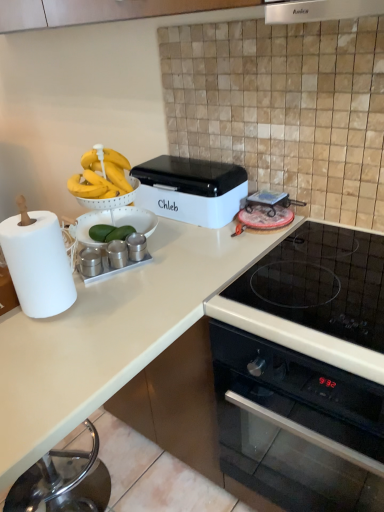
Where is `vacant area that is situated to the right of white paper at left`? This screenshot has width=384, height=512. vacant area that is situated to the right of white paper at left is located at coordinates (112, 304).